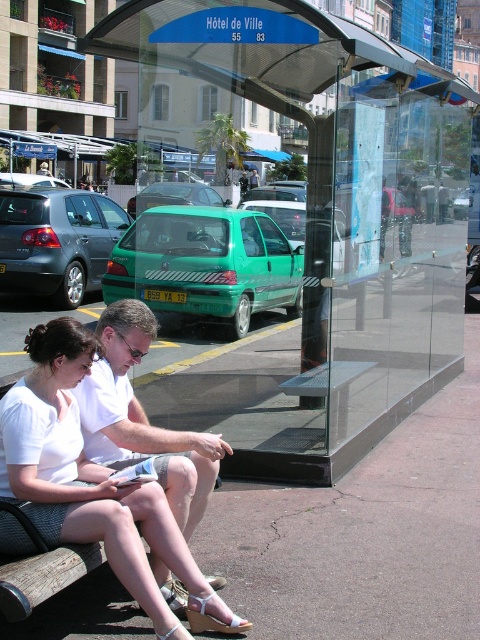
Does green matte car at center have a lesser height compared to white cotton shirt at center?

No, green matte car at center is not shorter than white cotton shirt at center.

Is green matte car at center wider than white cotton shirt at center?

Indeed, green matte car at center has a greater width compared to white cotton shirt at center.

Is point (256, 241) more distant than point (164, 465)?

Yes, point (256, 241) is behind point (164, 465).

Locate an element on the screen. green matte car at center is located at coordinates (205, 264).

Which is more to the left, transparent glass bus stop at center or white cotton shirt at center?

white cotton shirt at center is more to the left.

Between transparent glass bus stop at center and white cotton shirt at center, which one is positioned higher?

transparent glass bus stop at center is above.

Who is more distant from viewer, (179, 416) or (100, 413)?

The point (179, 416) is more distant.

At what (x,y) coordinates should I click in order to perform the action: click on transparent glass bus stop at center. Please return your answer as a coordinate pair (x, y). Looking at the image, I should click on (315, 218).

Can you confirm if transparent glass bus stop at center is thinner than green matte car at center?

In fact, transparent glass bus stop at center might be wider than green matte car at center.

The width and height of the screenshot is (480, 640). Describe the element at coordinates (315, 218) in the screenshot. I see `transparent glass bus stop at center` at that location.

Is point (160, 264) behind point (244, 332)?

That is False.

Identify the location of transparent glass bus stop at center. (315, 218).